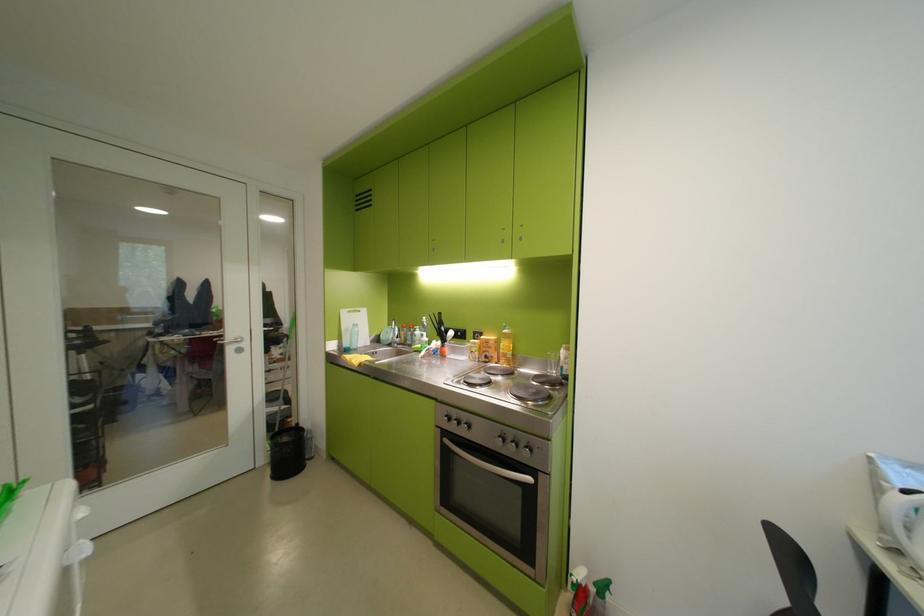
In order to click on sink faucet handle in this screenshot , I will do `click(399, 328)`.